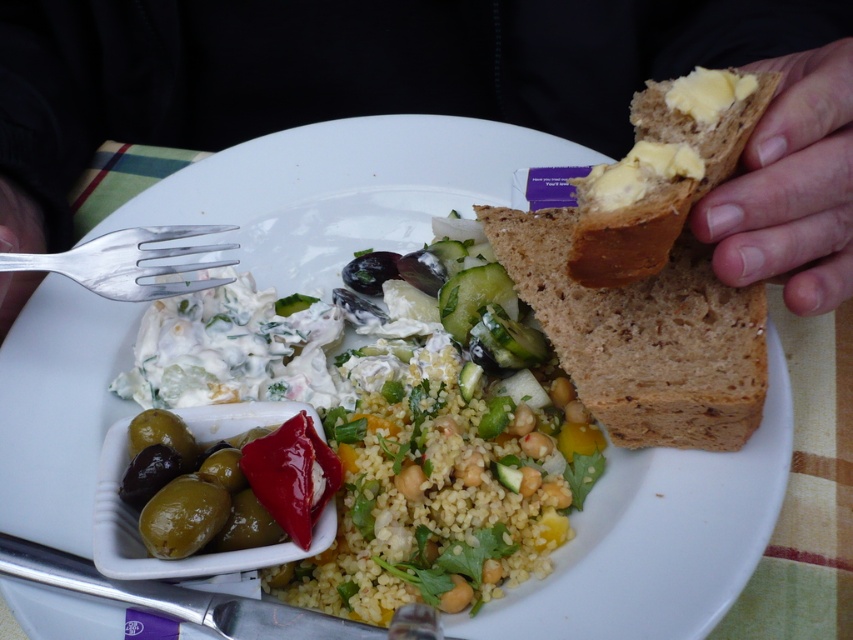
Is brown bread at right positioned at the back of silver metallic fork at left?

No.

Who is taller, brown bread at right or silver metallic fork at left?

With more height is brown bread at right.

Describe the element at coordinates (438, 97) in the screenshot. Image resolution: width=853 pixels, height=640 pixels. I see `brown bread at right` at that location.

At what (x,y) coordinates should I click in order to perform the action: click on brown bread at right. Please return your answer as a coordinate pair (x, y). Looking at the image, I should click on (438, 97).

Who is taller, brown textured bread at right or buttery brown bread at upper right?

brown textured bread at right

How distant is brown textured bread at right from buttery brown bread at upper right?

A distance of 6.34 centimeters exists between brown textured bread at right and buttery brown bread at upper right.

The image size is (853, 640). In order to click on brown textured bread at right in this screenshot , I will do `click(643, 337)`.

Between buttery brown bread at upper right and silver metallic fork at left, which one has less height?

silver metallic fork at left

Is buttery brown bread at upper right positioned in front of silver metallic fork at left?

Yes.

Locate an element on the screen. Image resolution: width=853 pixels, height=640 pixels. buttery brown bread at upper right is located at coordinates (662, 172).